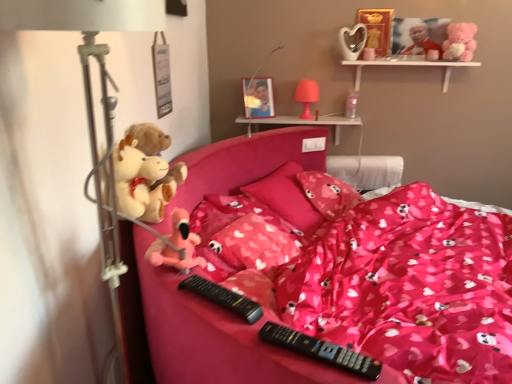
Question: In terms of height, does fluffy plush toys at left, the fourth toy from the top, look taller or shorter compared to pink plush toy at center, the second toy in the left-to-right sequence?

Choices:
 (A) tall
 (B) short

Answer: (A)

Question: Is fluffy plush toys at left, positioned as the fifth toy in right-to-left order, wider or thinner than pink plush toy at center, acting as the first toy starting from the bottom?

Choices:
 (A) wide
 (B) thin

Answer: (A)

Question: Which is farther from the pink fabric pillow at center, the second pillow when ordered from back to front?

Choices:
 (A) black plastic remote at lower center, which appears as the 2th remote when viewed from the back
 (B) fluffy plush toys at left, positioned as the fifth toy in right-to-left order
 (C) pink plastic table lamp at upper center, arranged as the 1th table lamp when viewed from the back
 (D) black plastic remote at center, which ranks as the first remote in back-to-front order
 (E) white wooden shelf at upper right, which appears as the second shelf when ordered from the bottom

Answer: (A)

Question: Which object is the farthest from the transparent plastic cup at upper center, arranged as the 3th toy when viewed from the right?

Choices:
 (A) pink fabric pillow at center, the second pillow when ordered from back to front
 (B) pink plush toy at center, positioned as the 1th toy in front-to-back order
 (C) pink fabric pillow at center, the first pillow from the back
 (D) pink plastic shelf at upper center, the 2th shelf viewed from the top
 (E) pink satin blanket at center

Answer: (B)